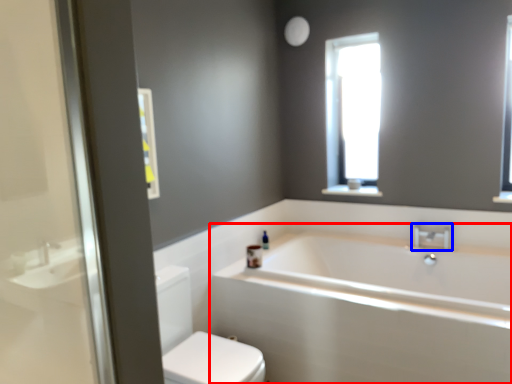
Question: Which point is closer to the camera, bathtub (highlighted by a red box) or tap (highlighted by a blue box)?

Choices:
 (A) bathtub
 (B) tap

Answer: (A)